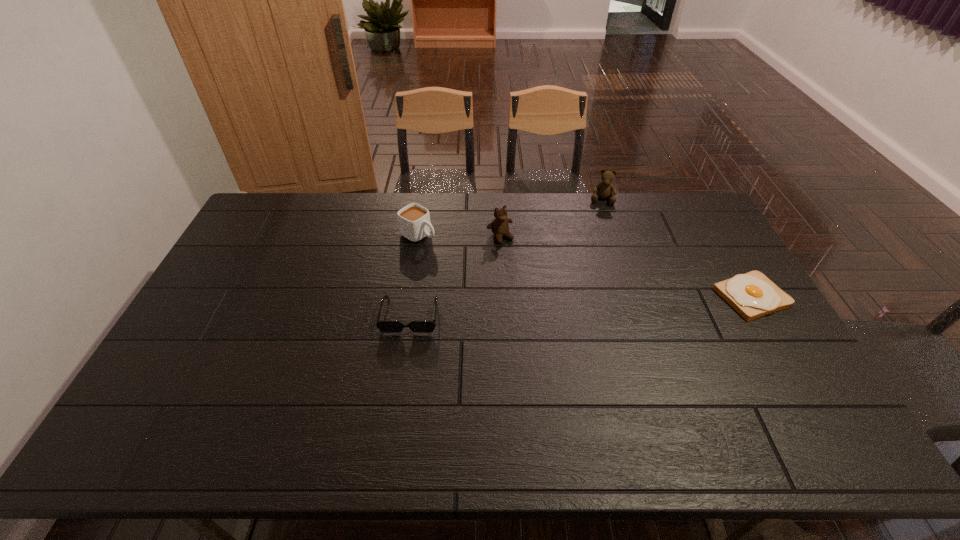
Where is `vacant area between the third tallest object and the sunglasses`? The height and width of the screenshot is (540, 960). vacant area between the third tallest object and the sunglasses is located at coordinates (414, 275).

This screenshot has width=960, height=540. Find the location of `empty space between the fourth object from left to right and the rightmost object`. empty space between the fourth object from left to right and the rightmost object is located at coordinates (677, 248).

The height and width of the screenshot is (540, 960). What are the coordinates of `empty space that is in between the nearer teddy bear and the farthest object` in the screenshot? It's located at (551, 218).

This screenshot has height=540, width=960. What are the coordinates of `free space between the farther teddy bear and the toast` in the screenshot? It's located at (677, 248).

The image size is (960, 540). Find the location of `vacant point located between the fourth object from left to right and the nearer teddy bear`. vacant point located between the fourth object from left to right and the nearer teddy bear is located at coordinates (551, 218).

Identify the location of free space between the third shortest object and the rightmost object. This screenshot has width=960, height=540. (585, 266).

This screenshot has height=540, width=960. I want to click on the fourth closest object to the third object from right to left, so click(753, 295).

Image resolution: width=960 pixels, height=540 pixels. I want to click on the closest object to the nearer teddy bear, so click(414, 223).

Where is `vacant position in the image that satisfies the following two spatial constraints: 1. on the front side of the third shortest object; 2. on the left side of the nearer teddy bear`? This screenshot has height=540, width=960. vacant position in the image that satisfies the following two spatial constraints: 1. on the front side of the third shortest object; 2. on the left side of the nearer teddy bear is located at coordinates (418, 237).